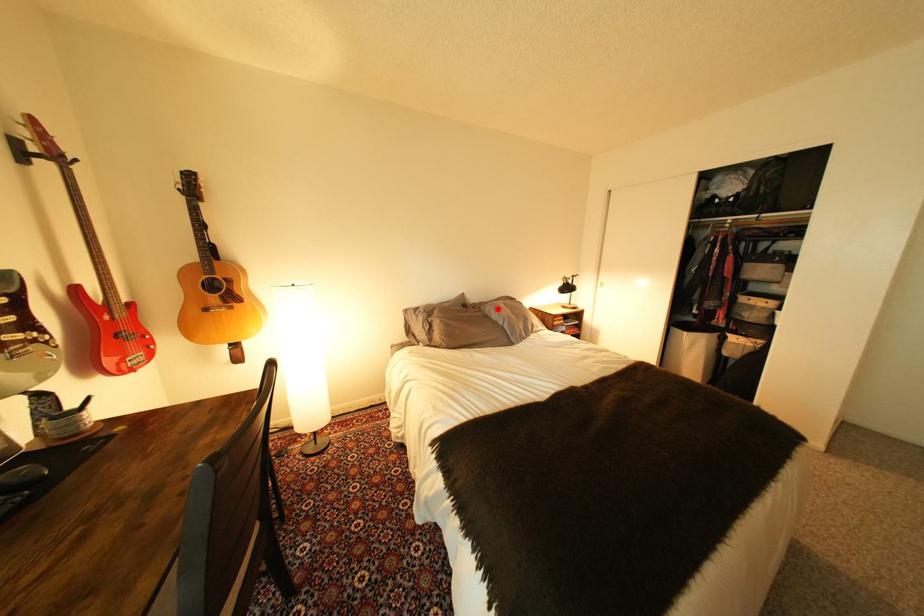
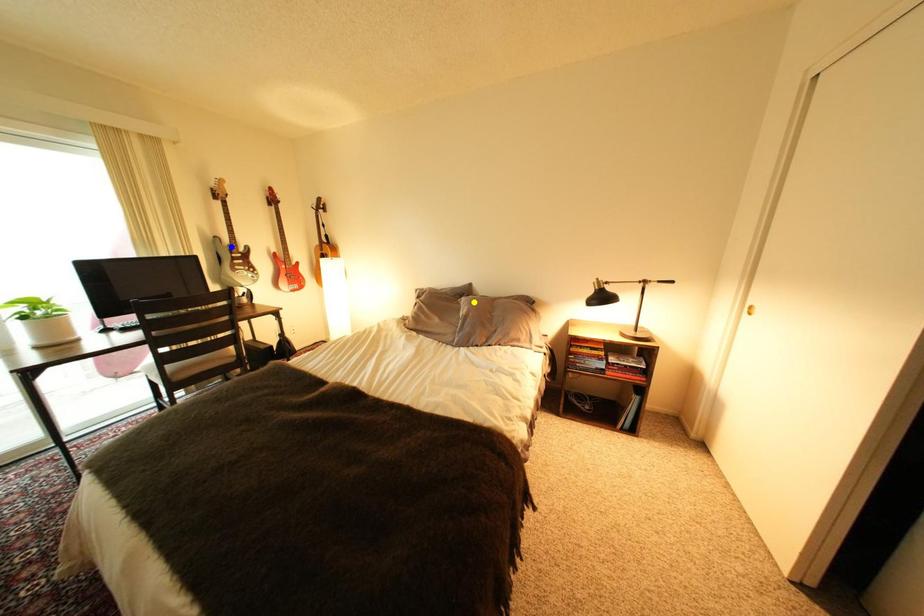
Question: I am providing you with two images of the same scene from different viewpoints. A red point is marked on the first image. You are given multiple points on the second image. Can you choose the point in image 2 that corresponds to the point in image 1?

Choices:
 (A) green point
 (B) yellow point
 (C) blue point

Answer: (B)